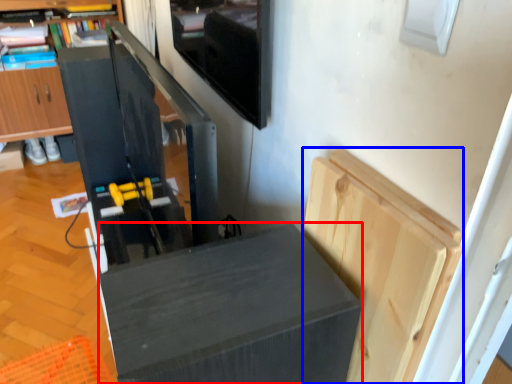
Question: Which object appears closest to the camera in this image, furniture (highlighted by a red box) or cabinetry (highlighted by a blue box)?

Choices:
 (A) furniture
 (B) cabinetry

Answer: (A)